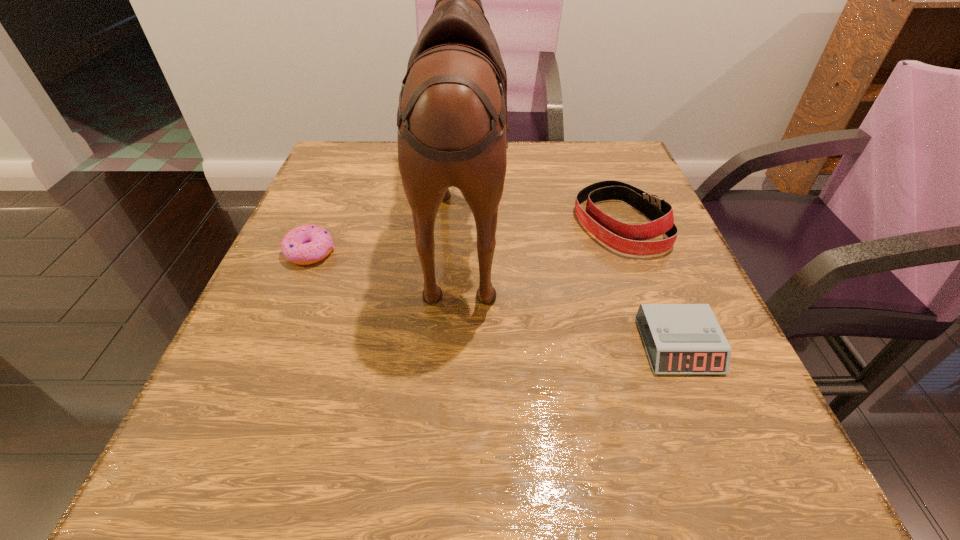
This screenshot has width=960, height=540. Identify the location of vacant space that satisfies the following two spatial constraints: 1. on the back of the saddle; 2. on the back side of the alarm clock. (457, 346).

Where is `vacant region that satisfies the following two spatial constraints: 1. on the back side of the alarm clock; 2. on the back of the saddle`? The image size is (960, 540). vacant region that satisfies the following two spatial constraints: 1. on the back side of the alarm clock; 2. on the back of the saddle is located at coordinates (627, 218).

The height and width of the screenshot is (540, 960). What are the coordinates of `vacant region that satisfies the following two spatial constraints: 1. on the back of the saddle; 2. on the right side of the dog collar` in the screenshot? It's located at click(463, 224).

At what (x,y) coordinates should I click in order to perform the action: click on free space that satisfies the following two spatial constraints: 1. on the back of the second object from left to right; 2. on the left side of the dog collar. Please return your answer as a coordinate pair (x, y). Looking at the image, I should click on (463, 224).

I want to click on free spot that satisfies the following two spatial constraints: 1. on the back of the second object from left to right; 2. on the back side of the alarm clock, so click(457, 346).